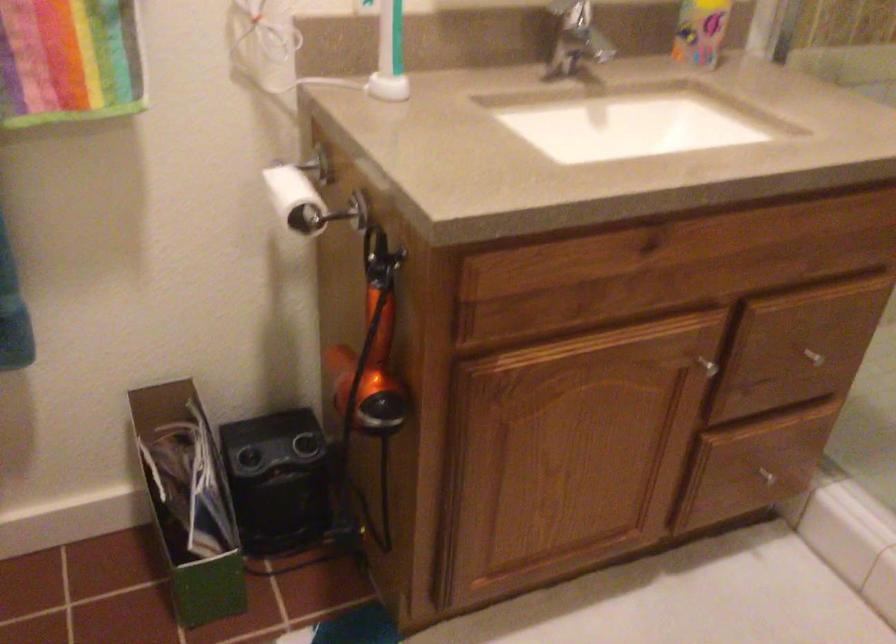
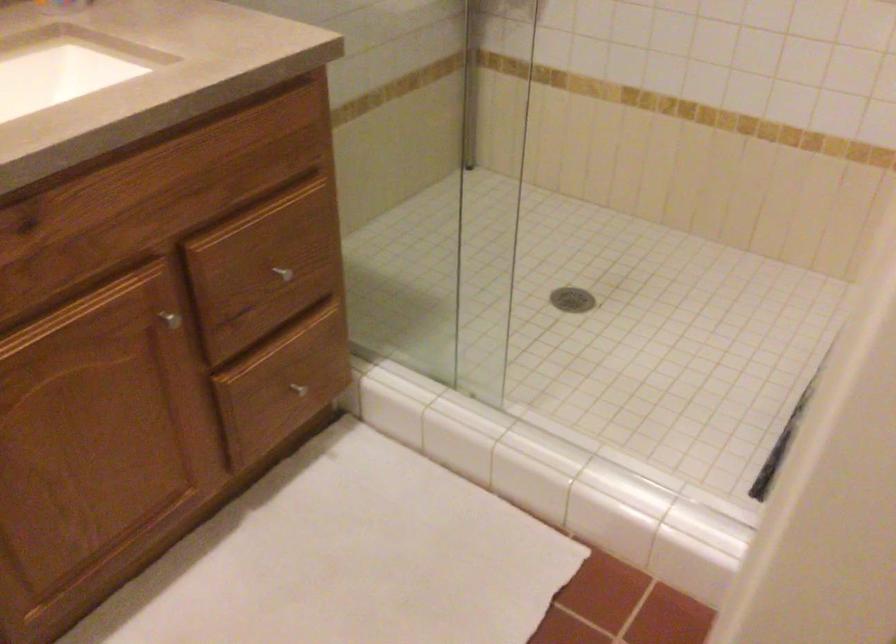
The point at (764, 476) is marked in the first image. Where is the corresponding point in the second image?

(297, 389)